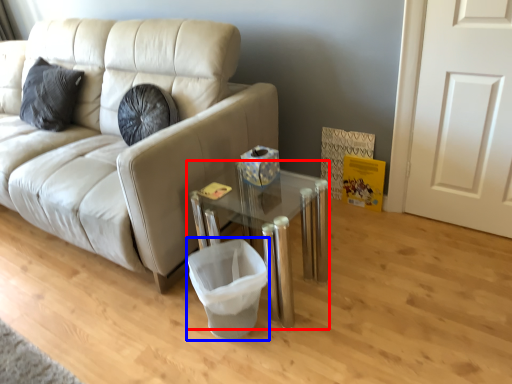
Question: Which of the following is the closest to the observer, table (highlighted by a red box) or laundry basket (highlighted by a blue box)?

Choices:
 (A) table
 (B) laundry basket

Answer: (A)